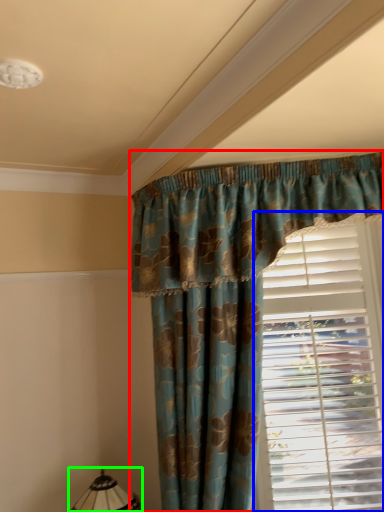
Question: Which is nearer to the curtain (highlighted by a red box)? window blind (highlighted by a blue box) or table lamp (highlighted by a green box).

Choices:
 (A) window blind
 (B) table lamp

Answer: (A)